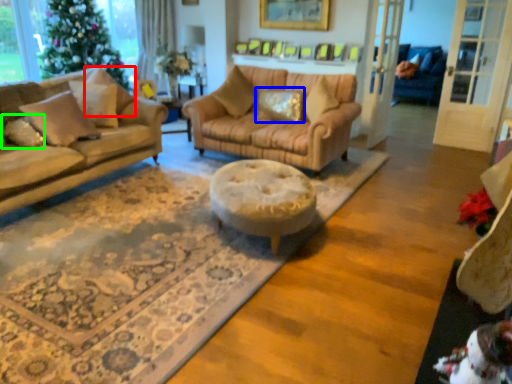
Question: Estimate the real-world distances between objects in this image. Which object is closer to pillow (highlighted by a red box), pillow (highlighted by a blue box) or pillow (highlighted by a green box)?

Choices:
 (A) pillow
 (B) pillow

Answer: (B)